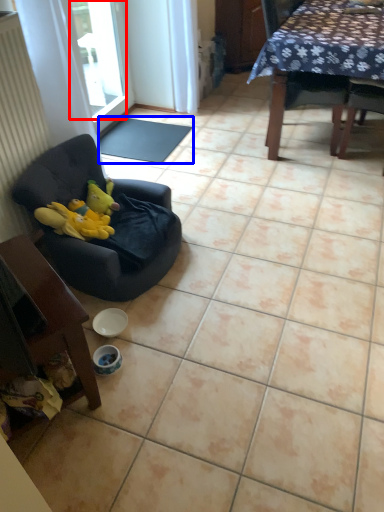
Question: Which object appears farthest to the camera in this image, window screen (highlighted by a red box) or mat (highlighted by a blue box)?

Choices:
 (A) window screen
 (B) mat

Answer: (B)